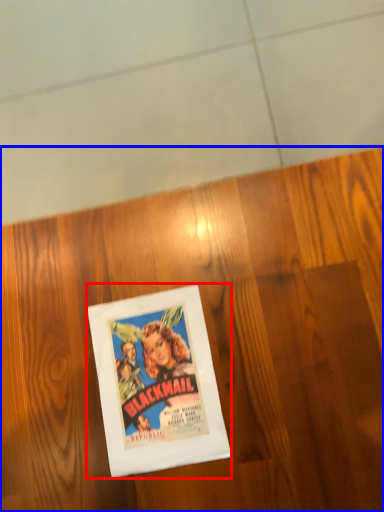
Question: Among these objects, which one is nearest to the camera, picture frame (highlighted by a red box) or plywood (highlighted by a blue box)?

Choices:
 (A) picture frame
 (B) plywood

Answer: (B)